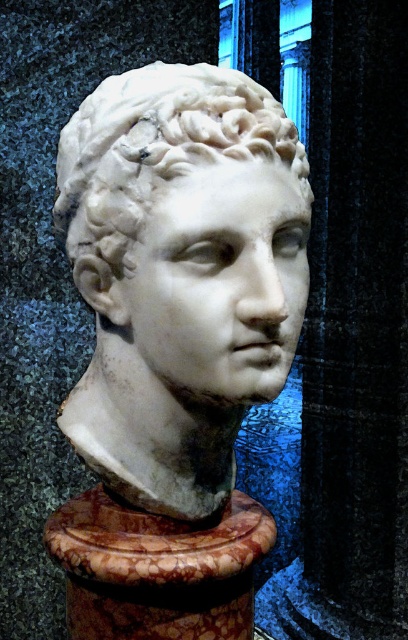
Which is above, white marble bust at center or marble pedestal at center?

Positioned higher is white marble bust at center.

Is point (124, 323) farther from camera compared to point (146, 552)?

That is False.

Describe the element at coordinates (153, 160) in the screenshot. The height and width of the screenshot is (640, 408). I see `white marble bust at center` at that location.

The height and width of the screenshot is (640, 408). In order to click on white marble bust at center in this screenshot , I will do `click(153, 160)`.